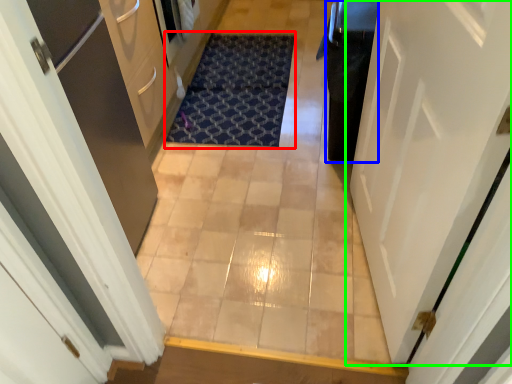
Question: Which object is positioned closest to doormat (highlighted by a red box)? Select from dark (highlighted by a blue box) and door (highlighted by a green box).

Choices:
 (A) dark
 (B) door

Answer: (A)